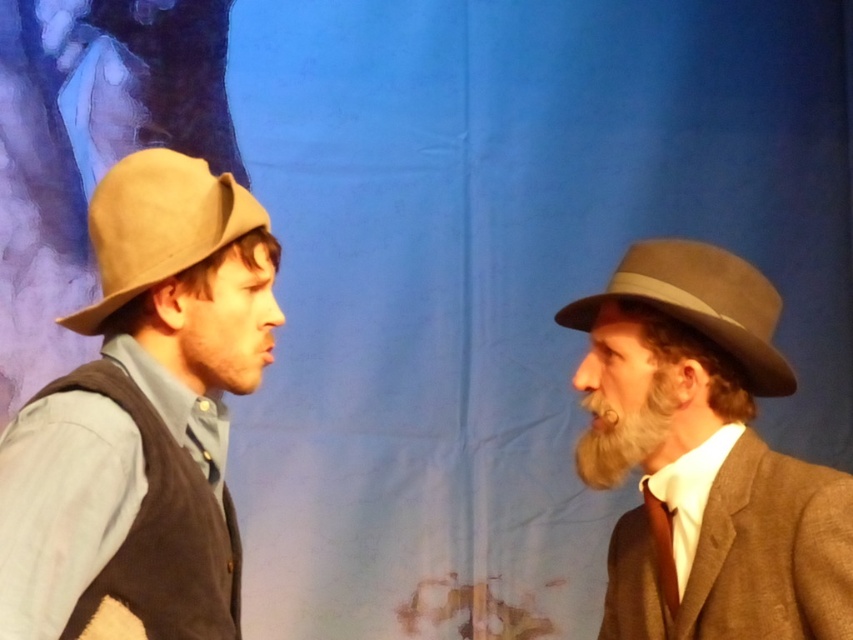
You are standing in the audience of a theater performance. You see the brown felt hat at right worn by an actor. If you want to throw a small object to hit the hat, and your throwing range is up to 4 feet, will you be able to reach it?

The brown felt hat at right is 4.31 feet away from the viewer. Since your throwing range is up to 4 feet, you cannot reach it as the distance exceeds your maximum range.

You are a costume designer preparing for a play. You have two items to place on a rack. The matte brown hat at left and the brown silk tie at right. Which item requires a larger space on the rack?

The matte brown hat at left requires a larger space on the rack because it is larger in size than the brown silk tie at right.